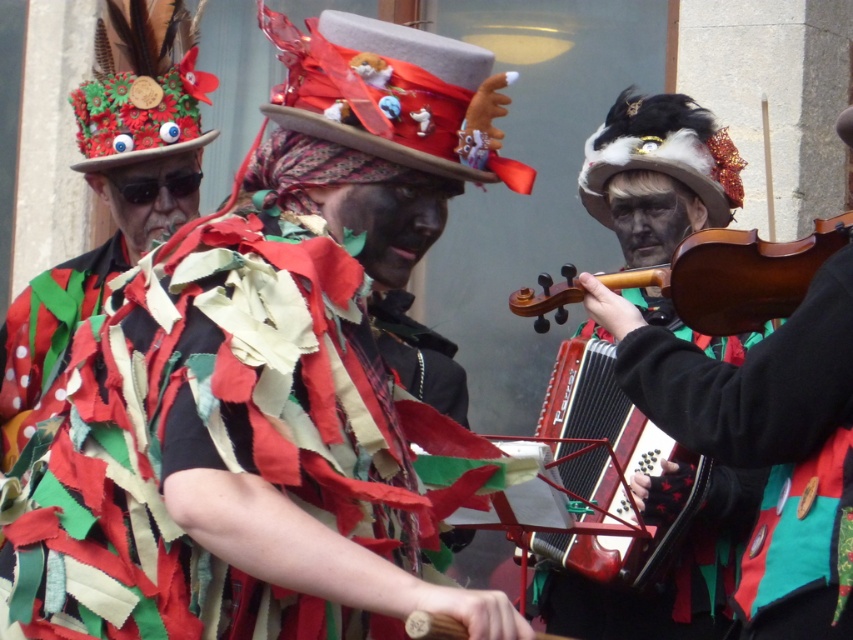
This screenshot has width=853, height=640. I want to click on wooden accordion at center, so click(605, 468).

Is multicolored fabric strips at center smaller than brown wooden violin at center?

Actually, multicolored fabric strips at center might be larger than brown wooden violin at center.

Is the position of multicolored fabric strips at center less distant than that of brown wooden violin at center?

Yes, multicolored fabric strips at center is in front of brown wooden violin at center.

Describe the element at coordinates (267, 394) in the screenshot. I see `multicolored fabric strips at center` at that location.

Where is `multicolored fabric strips at center`? This screenshot has width=853, height=640. multicolored fabric strips at center is located at coordinates (267, 394).

Is multicolored fabric strips at center below wooden accordion at center?

Incorrect, multicolored fabric strips at center is not positioned below wooden accordion at center.

Is multicolored fabric strips at center smaller than wooden accordion at center?

No, multicolored fabric strips at center is not smaller than wooden accordion at center.

Who is more distant from viewer, (413,218) or (635,412)?

The point (635,412) is behind.

This screenshot has width=853, height=640. I want to click on multicolored fabric strips at center, so click(x=267, y=394).